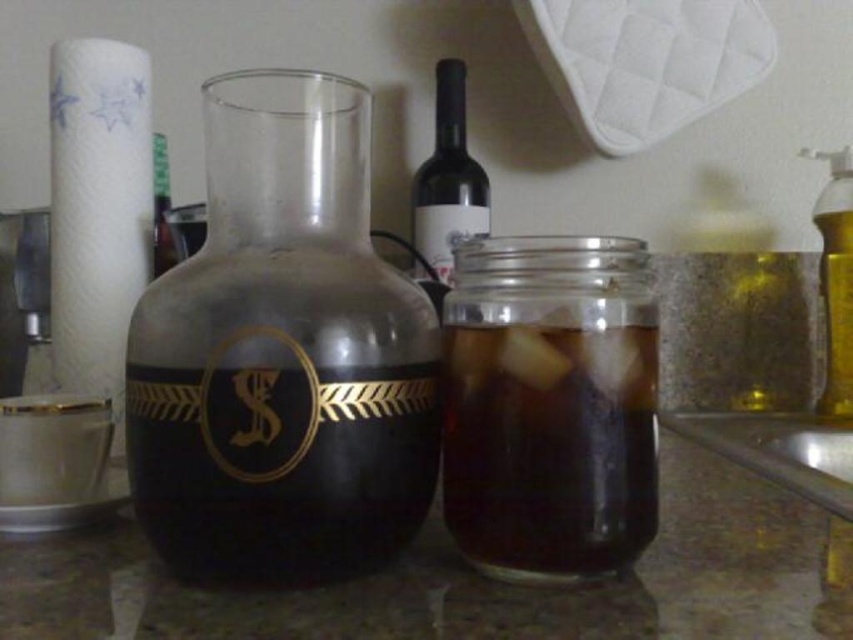
Can you confirm if white paper towel at left is positioned to the left of matte glass wine bottle at center?

Indeed, white paper towel at left is positioned on the left side of matte glass wine bottle at center.

In the scene shown: Who is lower down, white paper towel at left or matte glass wine bottle at center?

white paper towel at left is lower down.

Who is more distant from viewer, (x=135, y=144) or (x=432, y=262)?

Positioned behind is point (x=432, y=262).

I want to click on white paper towel at left, so click(x=97, y=211).

Between transparent glass carafe at center and matte glass wine bottle at center, which one is positioned higher?

matte glass wine bottle at center is above.

In the scene shown: Between transparent glass carafe at center and matte glass wine bottle at center, which one is positioned lower?

Positioned lower is transparent glass carafe at center.

Identify the location of transparent glass carafe at center. (282, 355).

Image resolution: width=853 pixels, height=640 pixels. Identify the location of transparent glass carafe at center. (282, 355).

Does transparent glass carafe at center have a greater width compared to transparent glass jar at center?

Yes.

Is transparent glass carafe at center above transparent glass jar at center?

Yes, transparent glass carafe at center is above transparent glass jar at center.

Is point (285, 97) more distant than point (508, 502)?

Yes, point (285, 97) is behind point (508, 502).

The image size is (853, 640). In order to click on transparent glass carafe at center in this screenshot , I will do `click(282, 355)`.